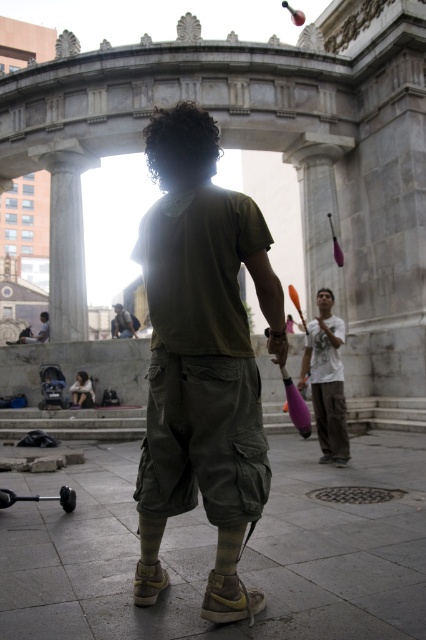
You are an observer positioned at the center of the image. You see a point marked at coordinates (x=201, y=358). Which object from the scene does this point correspond to?

The point at coordinates (x=201, y=358) corresponds to the matte green t shirt at center.